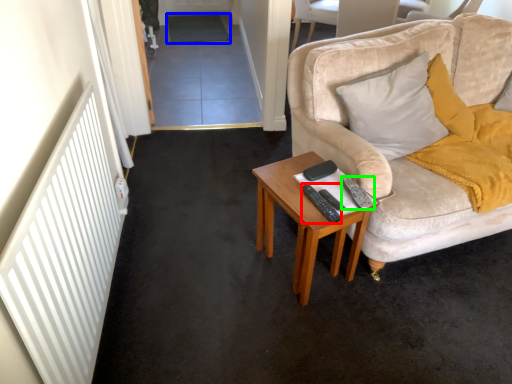
Question: Which is farther away from remote control (highlighted by a red box)? plain (highlighted by a blue box) or remote control (highlighted by a green box)?

Choices:
 (A) plain
 (B) remote control

Answer: (A)